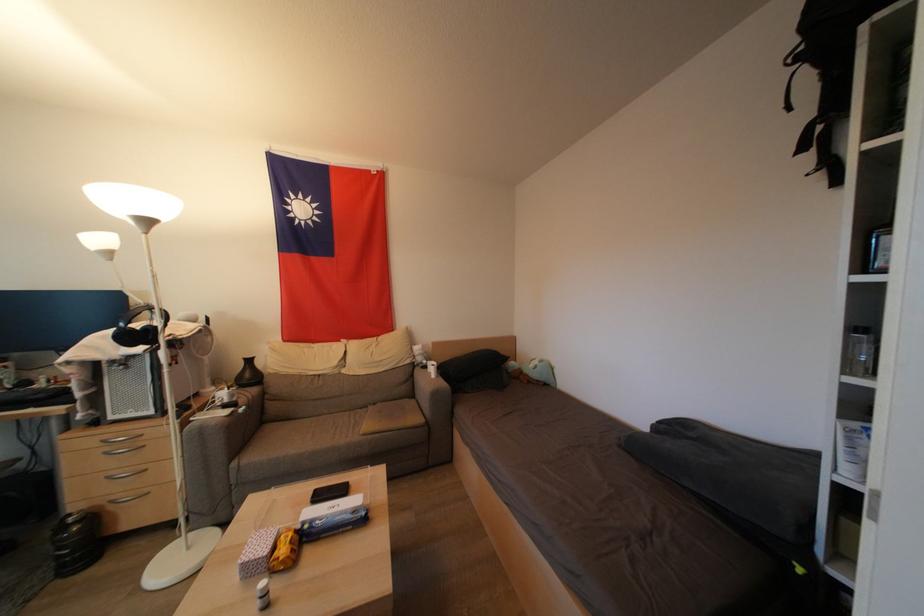
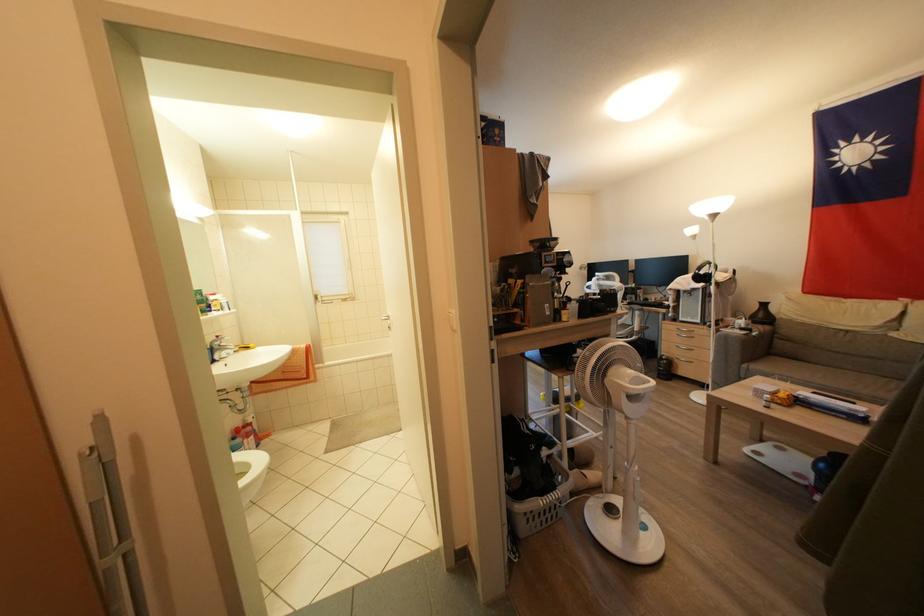
Where in the second image is the point corresponding to pixel 252 379 from the first image?

(766, 320)